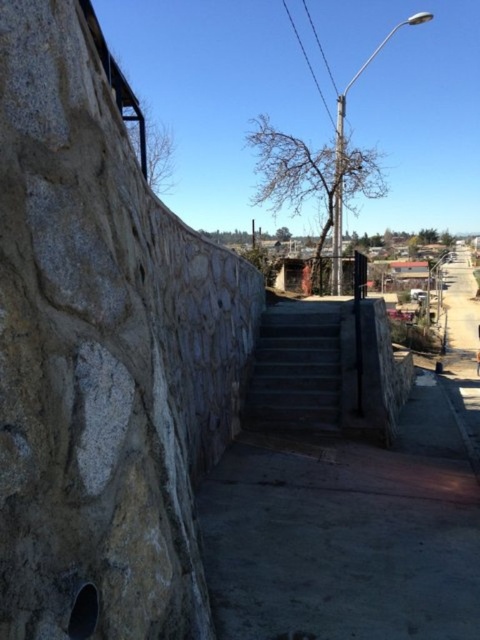
Question: Among these points, which one is farthest from the camera?

Choices:
 (A) (167, 467)
 (B) (264, 316)

Answer: (B)

Question: Does natural stone wall at left lie behind dark gray concrete stairs at center?

Choices:
 (A) no
 (B) yes

Answer: (A)

Question: Is natural stone wall at left thinner than dark gray concrete stairs at center?

Choices:
 (A) no
 (B) yes

Answer: (B)

Question: Where is natural stone wall at left located in relation to dark gray concrete stairs at center in the image?

Choices:
 (A) above
 (B) below

Answer: (A)